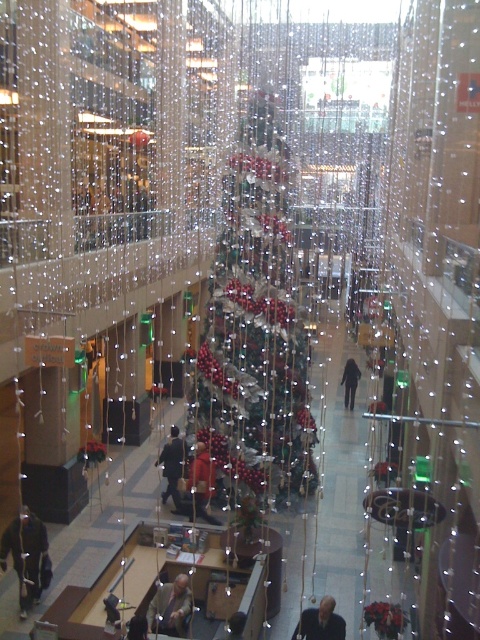
Based on the photo, you are standing at the entrance of the mall and want to find the shiny metallic tree at center. According to the mall layout, which direction should you walk to reach it?

Since the shiny metallic tree at center is located at coordinates approximately 0.512 on the x and 0.533 on the y axis, it is centrally positioned within the mall. Therefore, you should walk straight ahead from the entrance towards the center of the mall to reach the shiny metallic tree at center.

You are a store manager in the mall and need to retrieve an item from the lower center area. You are currently standing near the light brown leather jacket at center. Which direction should you move to reach the dark suit at lower center?

The light brown leather jacket at center is positioned under the dark suit at lower center, so you should move downward to reach the dark suit at lower center.